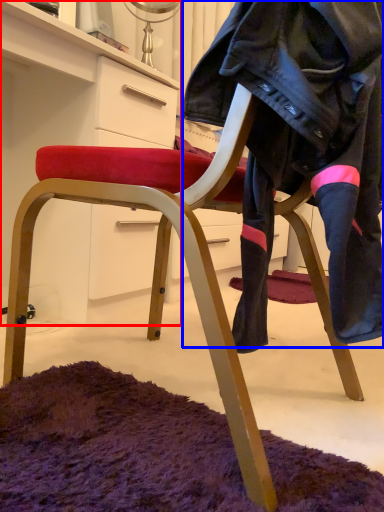
Question: Which object appears closest to the camera in this image, cabinetry (highlighted by a red box) or leather jacket (highlighted by a blue box)?

Choices:
 (A) cabinetry
 (B) leather jacket

Answer: (B)